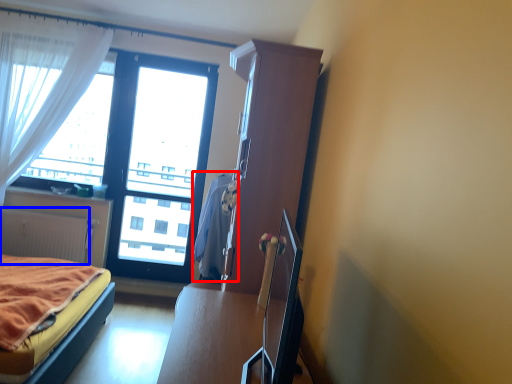
Question: Which object appears farthest to the camera in this image, blanket (highlighted by a red box) or radiator (highlighted by a blue box)?

Choices:
 (A) blanket
 (B) radiator

Answer: (B)